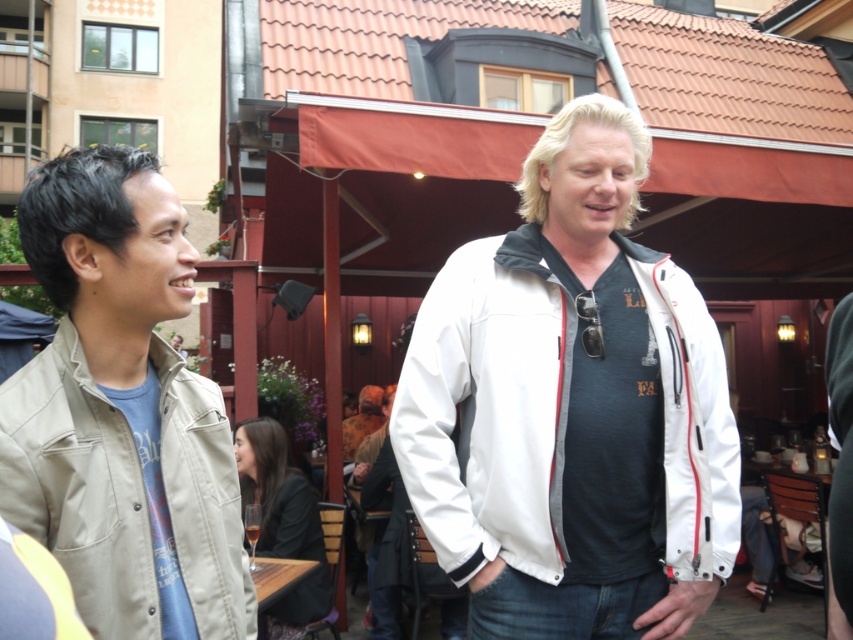
From the picture: Can you confirm if white smooth jacket at center is thinner than khaki cotton jacket at left?

Incorrect, white smooth jacket at center's width is not less than khaki cotton jacket at left's.

What do you see at coordinates (572, 406) in the screenshot? This screenshot has height=640, width=853. I see `white smooth jacket at center` at bounding box center [572, 406].

Who is more distant from viewer, (x=570, y=337) or (x=152, y=442)?

Point (x=570, y=337)

The width and height of the screenshot is (853, 640). In order to click on white smooth jacket at center in this screenshot , I will do `click(572, 406)`.

Is khaki cotton jacket at left shorter than dark brown leather jacket at lower center?

In fact, khaki cotton jacket at left may be taller than dark brown leather jacket at lower center.

Looking at this image, between khaki cotton jacket at left and dark brown leather jacket at lower center, which one is positioned higher?

khaki cotton jacket at left

Where is `khaki cotton jacket at left`? The height and width of the screenshot is (640, 853). khaki cotton jacket at left is located at coordinates point(120,410).

Can you confirm if white smooth jacket at center is positioned above dark brown leather jacket at lower center?

Yes, white smooth jacket at center is above dark brown leather jacket at lower center.

Which of these two, white smooth jacket at center or dark brown leather jacket at lower center, stands shorter?

Standing shorter between the two is dark brown leather jacket at lower center.

Locate an element on the screen. white smooth jacket at center is located at coordinates (572, 406).